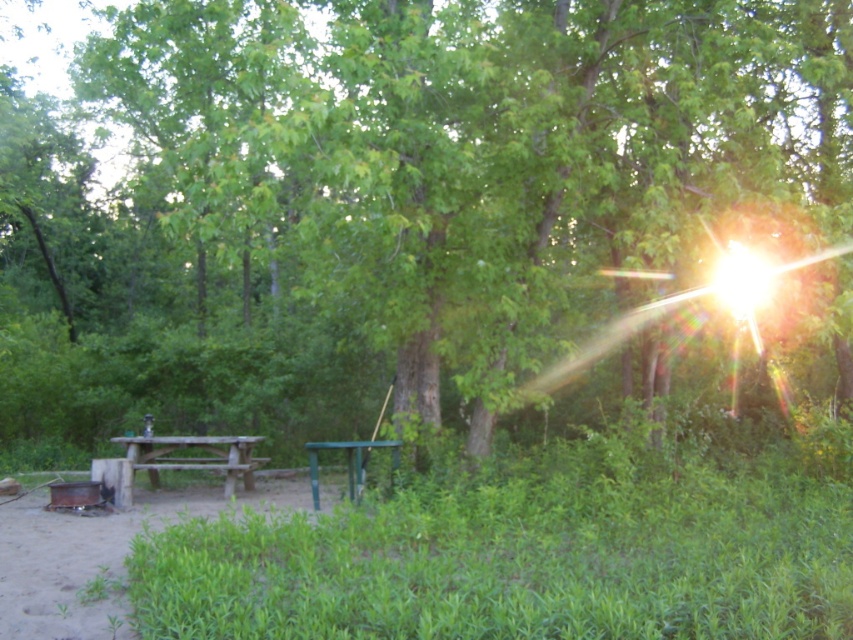
Question: Which point is closer to the camera taking this photo?

Choices:
 (A) (231, 451)
 (B) (322, 442)

Answer: (A)

Question: Can you confirm if wooden picnic table at left is thinner than green plastic table at center?

Choices:
 (A) yes
 (B) no

Answer: (B)

Question: Does wooden picnic table at left have a lesser width compared to green plastic table at center?

Choices:
 (A) yes
 (B) no

Answer: (B)

Question: Among these objects, which one is farthest from the camera?

Choices:
 (A) green plastic table at center
 (B) wooden picnic table at left

Answer: (B)

Question: Does wooden picnic table at left lie in front of green plastic table at center?

Choices:
 (A) yes
 (B) no

Answer: (B)

Question: Which point is farther to the camera?

Choices:
 (A) green plastic table at center
 (B) wooden picnic table at left

Answer: (B)